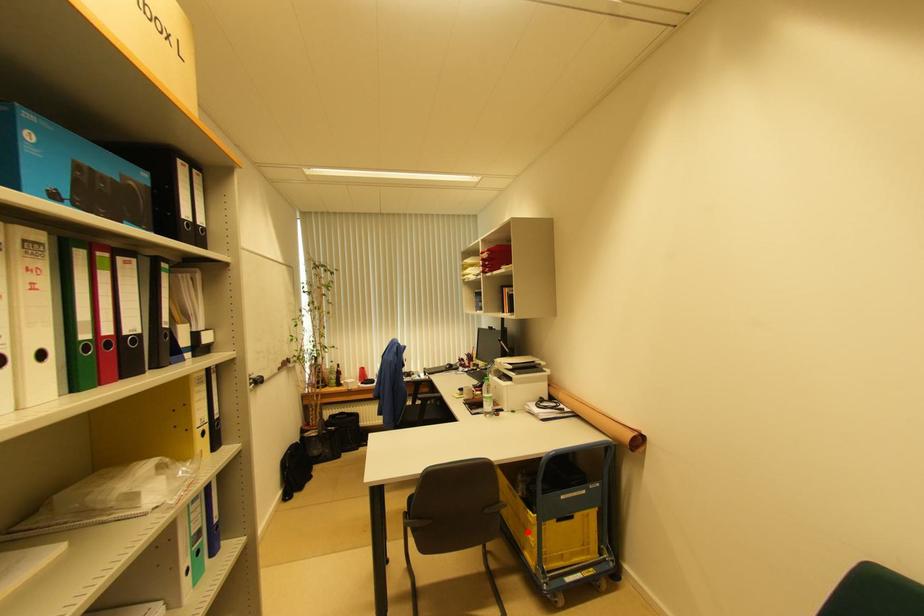
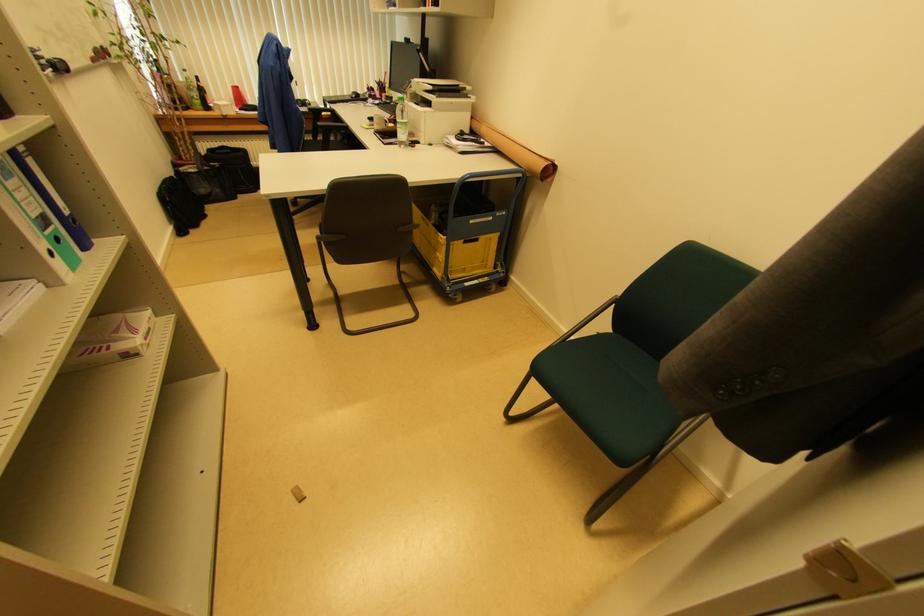
Where in the second image is the point corresponding to the highlighted location from the first image?

(438, 253)